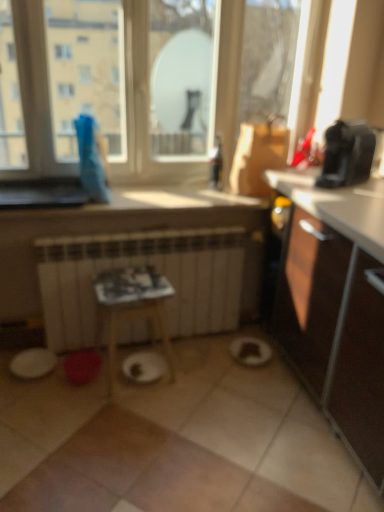
At what (x,y) coordinates should I click in order to perform the action: click on vacant area that lies in front of white matte radiator at center. Please return your answer as a coordinate pair (x, y). Looking at the image, I should click on (161, 432).